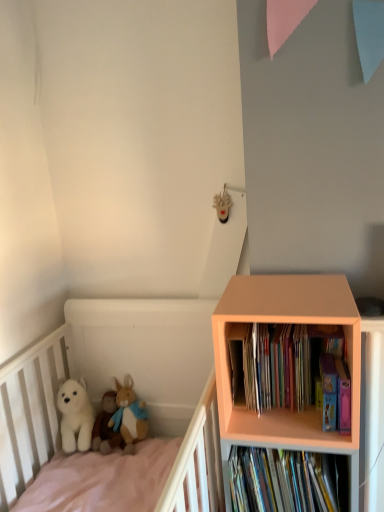
The height and width of the screenshot is (512, 384). Describe the element at coordinates (287, 481) in the screenshot. I see `hardcover books at lower right, marked as the 2th book in a top-to-bottom arrangement` at that location.

This screenshot has height=512, width=384. I want to click on hardcover books at lower right, which is the 1th book in bottom-to-top order, so click(x=287, y=481).

Where is `fluffy brown plush at lower left, which appears as the 1th toy when viewed from the right`? Image resolution: width=384 pixels, height=512 pixels. fluffy brown plush at lower left, which appears as the 1th toy when viewed from the right is located at coordinates (129, 415).

Find the location of a particular element. peach wood bookcase at right is located at coordinates (284, 322).

Locate an element on the screen. The width and height of the screenshot is (384, 512). hardcover books at lower right, which is the 1th book in bottom-to-top order is located at coordinates (287, 481).

Considering the relative positions of white plush bear at lower left, which is the 2th toy in right-to-left order, and multicolored cardboard books at right, the second book positioned from the bottom, in the image provided, is white plush bear at lower left, which is the 2th toy in right-to-left order, behind multicolored cardboard books at right, the second book positioned from the bottom,?

Yes, it is.

Who is smaller, white plush bear at lower left, which is the 2th toy in right-to-left order, or multicolored cardboard books at right, the second book positioned from the bottom?

white plush bear at lower left, which is the 2th toy in right-to-left order.

From a real-world perspective, is white plush bear at lower left, which is the first toy from left to right, above or below multicolored cardboard books at right, the second book positioned from the bottom?

From a real-world perspective, white plush bear at lower left, which is the first toy from left to right, is physically below multicolored cardboard books at right, the second book positioned from the bottom.

Looking at this image, is multicolored cardboard books at right, positioned as the first book in top-to-bottom order, oriented towards white plush dog at lower left?

No, multicolored cardboard books at right, positioned as the first book in top-to-bottom order, does not turn towards white plush dog at lower left.

Does multicolored cardboard books at right, positioned as the first book in top-to-bottom order, have a larger size compared to white plush dog at lower left?

Yes, multicolored cardboard books at right, positioned as the first book in top-to-bottom order, is bigger than white plush dog at lower left.

Visually, is multicolored cardboard books at right, positioned as the first book in top-to-bottom order, positioned to the left or to the right of white plush dog at lower left?

Clearly, multicolored cardboard books at right, positioned as the first book in top-to-bottom order, is on the right of white plush dog at lower left in the image.

From the image's perspective, does multicolored cardboard books at right, positioned as the first book in top-to-bottom order, appear lower than white plush dog at lower left?

No.

Can you see white plush dog at lower left touching fluffy brown plush at lower left, which appears as the 1th toy when viewed from the right?

They are not placed beside each other.

From the image's perspective, relative to fluffy brown plush at lower left, the 2th toy positioned from the left, is white plush dog at lower left above or below?

Clearly, from the image's perspective, white plush dog at lower left is above fluffy brown plush at lower left, the 2th toy positioned from the left.

Is white plush dog at lower left wider or thinner than fluffy brown plush at lower left, the 2th toy positioned from the left?

In the image, white plush dog at lower left appears to be more narrow than fluffy brown plush at lower left, the 2th toy positioned from the left.

In the scene shown: Based on their sizes in the image, would you say white plush dog at lower left is bigger or smaller than fluffy brown plush at lower left, the 2th toy positioned from the left?

white plush dog at lower left is smaller than fluffy brown plush at lower left, the 2th toy positioned from the left.

Is white plush at left oriented towards white plush dog at lower left?

No, white plush at left is not turned towards white plush dog at lower left.

How many degrees apart are the facing directions of white plush at left and white plush dog at lower left?

The facing directions of white plush at left and white plush dog at lower left are 88 degrees apart.

In terms of size, does white plush at left appear bigger or smaller than white plush dog at lower left?

In the image, white plush at left appears to be larger than white plush dog at lower left.

Which of these two, white plush at left or white plush dog at lower left, is thinner?

A: white plush dog at lower left is thinner.

Is hardcover books at lower right, marked as the 2th book in a top-to-bottom arrangement, oriented away from white plush dog at lower left?

That's not correct — hardcover books at lower right, marked as the 2th book in a top-to-bottom arrangement, is not looking away from white plush dog at lower left.

Which is correct: hardcover books at lower right, marked as the 2th book in a top-to-bottom arrangement, is inside white plush dog at lower left, or outside of it?

The correct answer is: outside.

Does hardcover books at lower right, which is the 1th book in bottom-to-top order, come behind white plush dog at lower left?

That is False.

Considering the sizes of objects white plush dog at lower left and white plush at left in the image provided, who is smaller, white plush dog at lower left or white plush at left?

white plush dog at lower left.

Find the location of a particular element. dog above the white plush at left (from the image's perspective) is located at coordinates (75, 415).

Can you confirm if white plush dog at lower left is positioned to the left of white plush at left?

Yes.

Would you say white plush dog at lower left contains white plush at left?

No.

Considering the positions of points (316, 488) and (239, 364), is point (316, 488) closer to camera compared to point (239, 364)?

That is True.

Would you say hardcover books at lower right, which is the 1th book in bottom-to-top order, is outside multicolored cardboard books at right, the second book positioned from the bottom?

hardcover books at lower right, which is the 1th book in bottom-to-top order, lies outside multicolored cardboard books at right, the second book positioned from the bottom,'s area.

From a real-world perspective, is hardcover books at lower right, marked as the 2th book in a top-to-bottom arrangement, located beneath multicolored cardboard books at right, the second book positioned from the bottom?

Indeed, from a real-world perspective, hardcover books at lower right, marked as the 2th book in a top-to-bottom arrangement, is positioned beneath multicolored cardboard books at right, the second book positioned from the bottom.

Considering the sizes of hardcover books at lower right, which is the 1th book in bottom-to-top order, and multicolored cardboard books at right, the second book positioned from the bottom, in the image, is hardcover books at lower right, which is the 1th book in bottom-to-top order, taller or shorter than multicolored cardboard books at right, the second book positioned from the bottom,?

A: In the image, hardcover books at lower right, which is the 1th book in bottom-to-top order, appears to be taller than multicolored cardboard books at right, the second book positioned from the bottom.

Find the location of a particular element. The image size is (384, 512). the 2nd book above the white plush bear at lower left, which is the first toy from left to right (from the image's perspective) is located at coordinates (292, 370).

Locate an element on the screen. the 1st book counting from the right side of the white plush dog at lower left is located at coordinates (292, 370).

From the picture: From the image, which object appears to be nearer to white plush bear at lower left, which is the 2th toy in right-to-left order, hardcover books at lower right, which is the 1th book in bottom-to-top order, or white plush dog at lower left?

white plush dog at lower left is positioned closer to the anchor white plush bear at lower left, which is the 2th toy in right-to-left order.

Consider the image. From the image, which object appears to be nearer to peach wood bookcase at right, white plush bear at lower left, which is the first toy from left to right, or multicolored cardboard books at right, positioned as the first book in top-to-bottom order?

multicolored cardboard books at right, positioned as the first book in top-to-bottom order, is positioned closer to the anchor peach wood bookcase at right.

Which object lies nearer to the anchor point peach wood bookcase at right, fluffy brown plush at lower left, which appears as the 1th toy when viewed from the right, or multicolored cardboard books at right, positioned as the first book in top-to-bottom order?

Among the two, multicolored cardboard books at right, positioned as the first book in top-to-bottom order, is located nearer to peach wood bookcase at right.

Which object lies further to the anchor point white plush at left, white plush bear at lower left, which is the first toy from left to right, or hardcover books at lower right, marked as the 2th book in a top-to-bottom arrangement?

hardcover books at lower right, marked as the 2th book in a top-to-bottom arrangement, is further to white plush at left.

Looking at the image, which one is located further to hardcover books at lower right, which is the 1th book in bottom-to-top order, white plush at left or multicolored cardboard books at right, positioned as the first book in top-to-bottom order?

white plush at left.

Looking at the image, which one is located closer to peach wood bookcase at right, white plush dog at lower left or white plush at left?

white plush at left is positioned closer to the anchor peach wood bookcase at right.

When comparing their distances from white plush dog at lower left, does fluffy brown plush at lower left, the 2th toy positioned from the left, or multicolored cardboard books at right, positioned as the first book in top-to-bottom order, seem further?

multicolored cardboard books at right, positioned as the first book in top-to-bottom order, lies further to white plush dog at lower left than the other object.

Estimate the real-world distances between objects in this image. Which object is closer to fluffy brown plush at lower left, which appears as the 1th toy when viewed from the right, peach wood bookcase at right or hardcover books at lower right, which is the 1th book in bottom-to-top order?

The object closer to fluffy brown plush at lower left, which appears as the 1th toy when viewed from the right, is hardcover books at lower right, which is the 1th book in bottom-to-top order.

The height and width of the screenshot is (512, 384). I want to click on book between white plush at left and peach wood bookcase at right from left to right, so click(x=292, y=370).

Find the location of a particular element. The height and width of the screenshot is (512, 384). book between white plush bear at lower left, which is the 2th toy in right-to-left order, and hardcover books at lower right, which is the 1th book in bottom-to-top order, in the horizontal direction is located at coordinates pyautogui.click(x=292, y=370).

Identify the location of toy between white plush at left and white plush bear at lower left, which is the first toy from left to right, from front to back. (129, 415).

Locate an element on the screen. The width and height of the screenshot is (384, 512). bookcase between white plush at left and white plush dog at lower left along the z-axis is located at coordinates (284, 322).